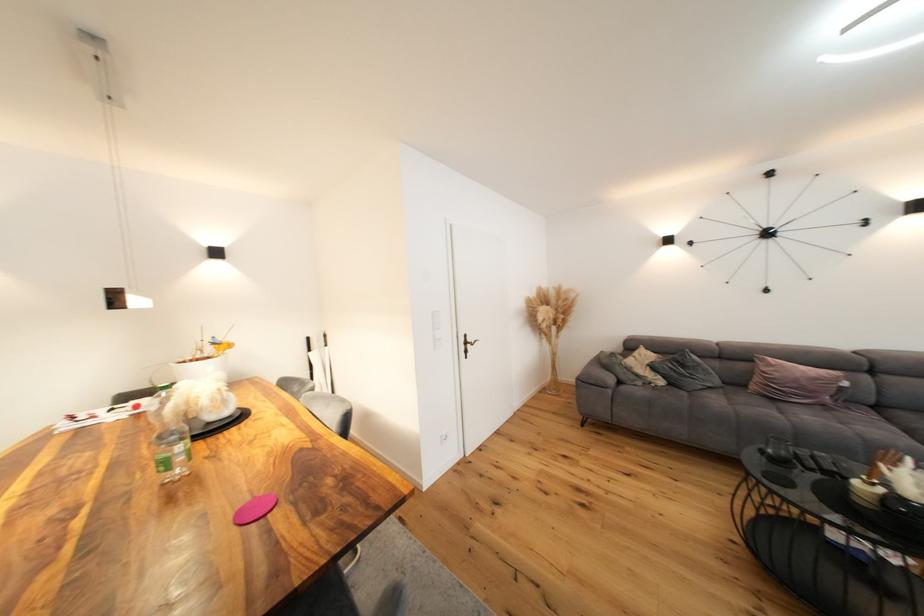
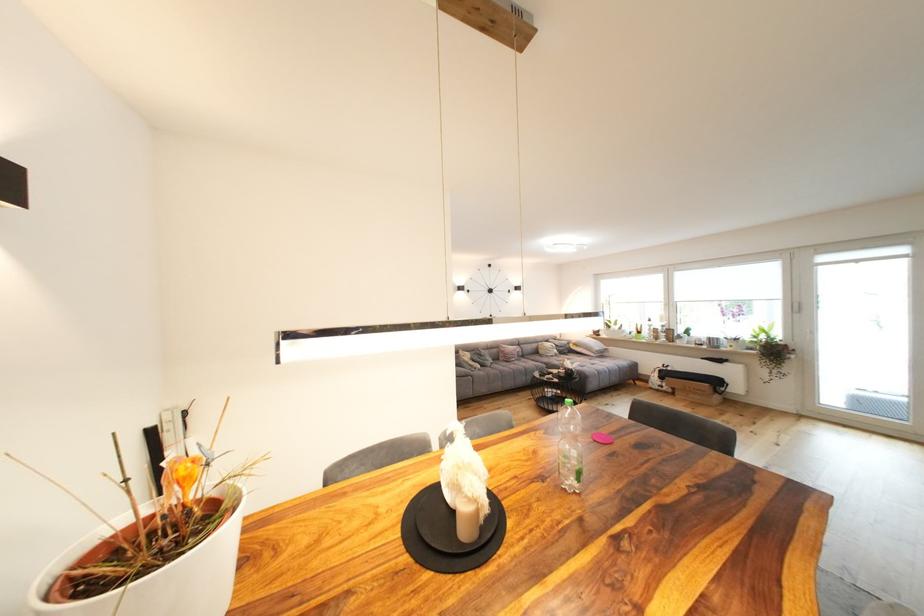
The point at [660,369] is marked in the first image. Where is the corresponding point in the second image?

(480, 361)